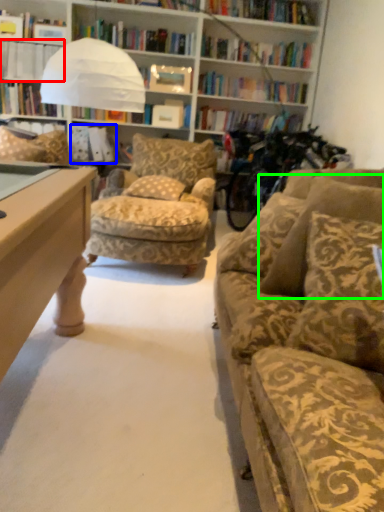
Question: Which is farther away from book (highlighted by a red box)? book (highlighted by a blue box) or pillow (highlighted by a green box)?

Choices:
 (A) book
 (B) pillow

Answer: (B)